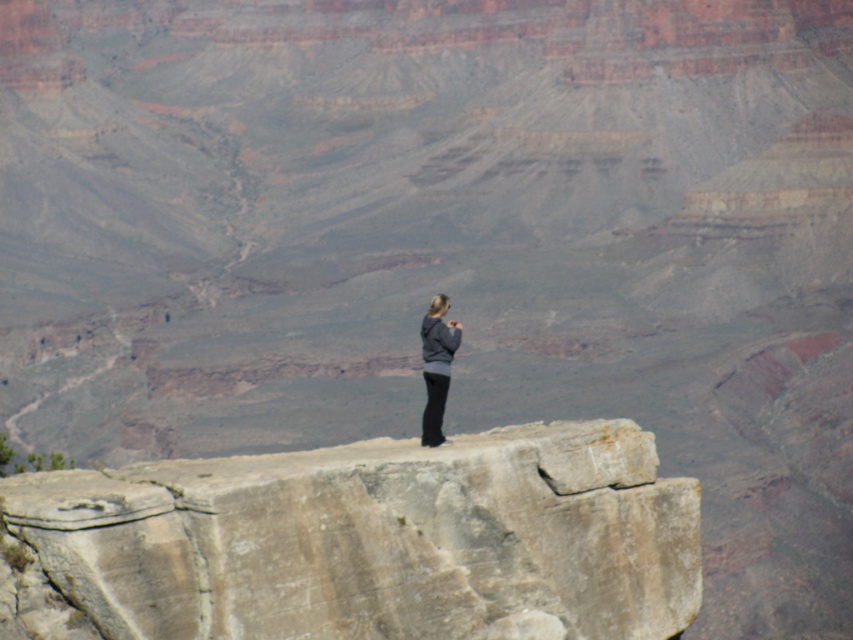
Does point (490, 461) lie behind point (430, 376)?

That is False.

Is rustic stone cliff at center positioned behind gray fabric jacket at center?

No, rustic stone cliff at center is in front of gray fabric jacket at center.

At what (x,y) coordinates should I click in order to perform the action: click on rustic stone cliff at center. Please return your answer as a coordinate pair (x, y). The image size is (853, 640). Looking at the image, I should click on (361, 541).

You are a GUI agent. You are given a task and a screenshot of the screen. Output one action in this format:
    pyautogui.click(x=<x>, y=<y>)
    Task: Click on the rustic stone cliff at center
    Image resolution: width=853 pixels, height=640 pixels.
    Given the screenshot: What is the action you would take?
    pyautogui.click(x=361, y=541)